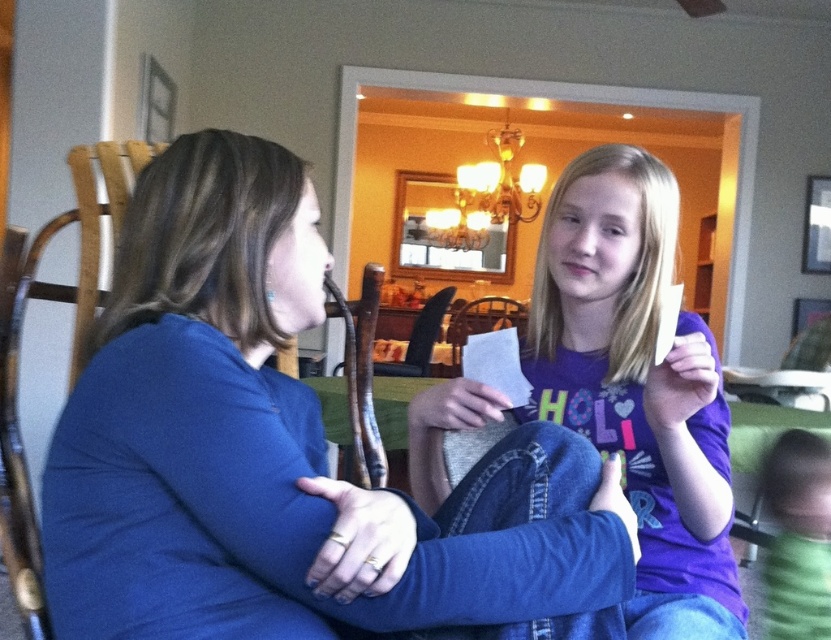
Based on the photo, you are a photographer setting up for a group photo. You need to position the blue fabric shirt at center and the purple cotton shirt at center so that both are visible in the frame. Based on their current positions, which of the two shirts should be moved to ensure both are fully visible?

The blue fabric shirt at center is in front of the purple cotton shirt at center. To ensure both are fully visible, the blue fabric shirt at center should be moved slightly backward or the purple cotton shirt at center moved forward so that they are not overlapping.

You need to place a small sticker on the blue fabric shirt at center. According to the coordinates provided, where should you place it?

The blue fabric shirt at center should have the sticker placed at point (283,452).

You are a photographer setting up for a group photo. You have two subjects wearing the blue fabric shirt at center and the purple cotton shirt at center. The minimum distance required between subjects for your camera lens to focus properly is 12 inches. Based on their current positions, will the camera be able to focus on both subjects simultaneously?

The blue fabric shirt at center is 13.09 inches from the purple cotton shirt at center. Since the distance between them is greater than the minimum required 12 inches, the camera can focus on both subjects simultaneously.